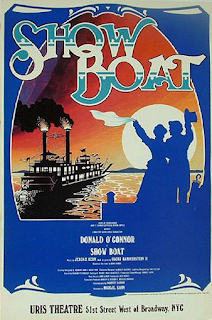
The image size is (212, 320). I want to click on window, so click(x=65, y=169).